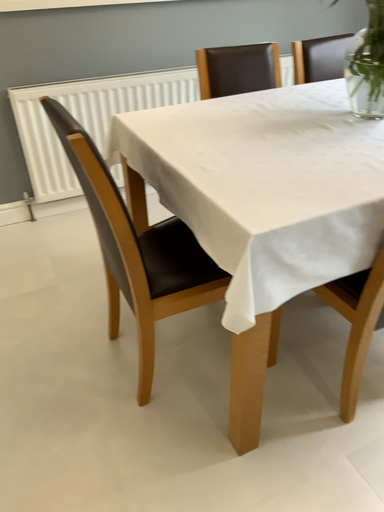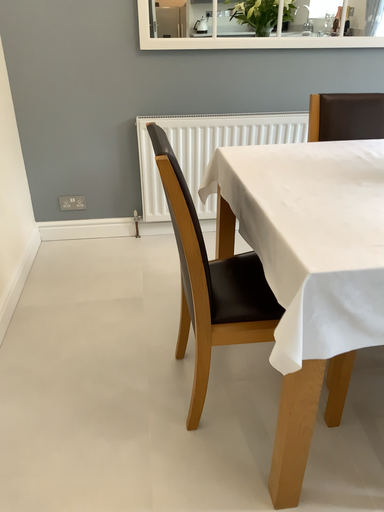
Question: Which way did the camera rotate in the video?

Choices:
 (A) rotated right
 (B) rotated left

Answer: (B)